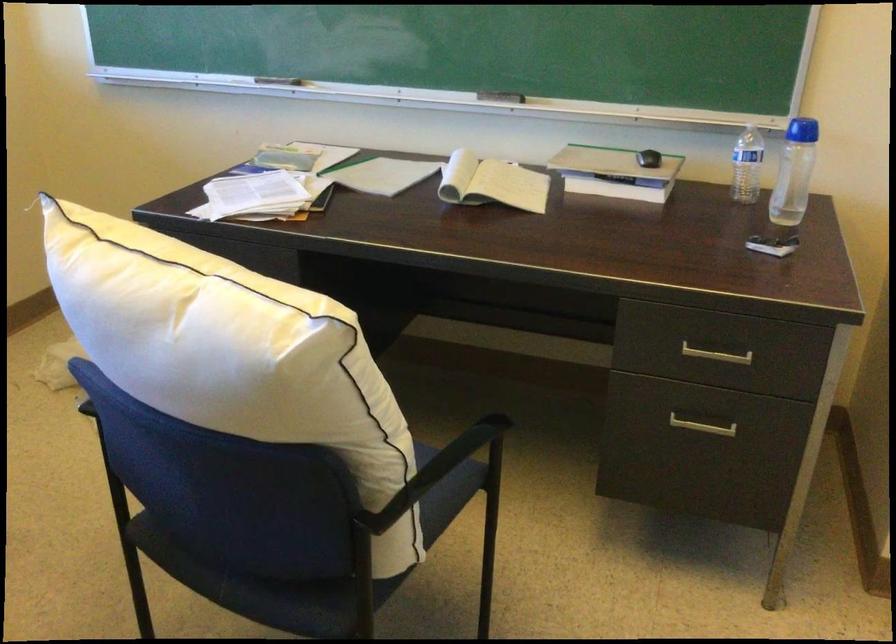
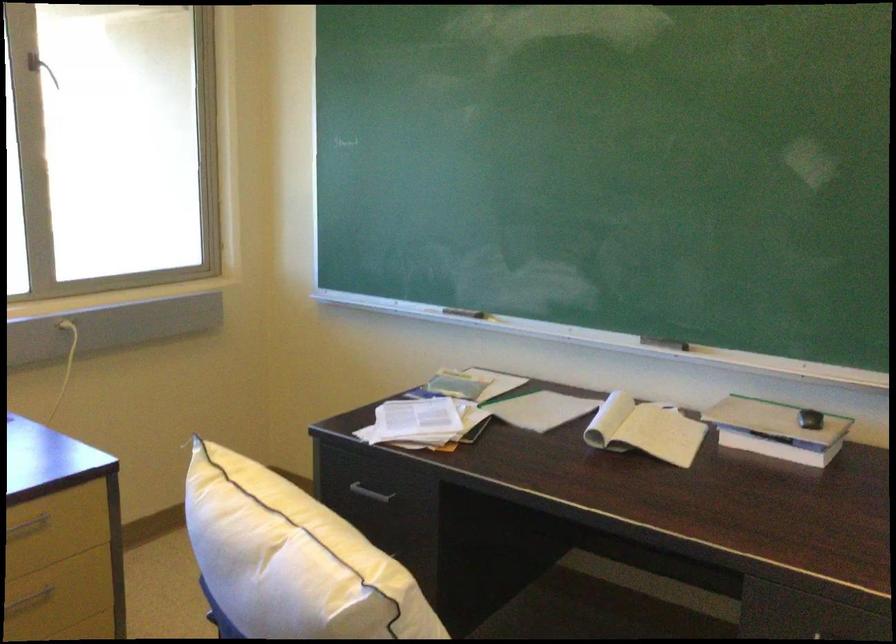
Locate, in the second image, the point that corresponds to pixel 205 307 in the first image.

(291, 559)